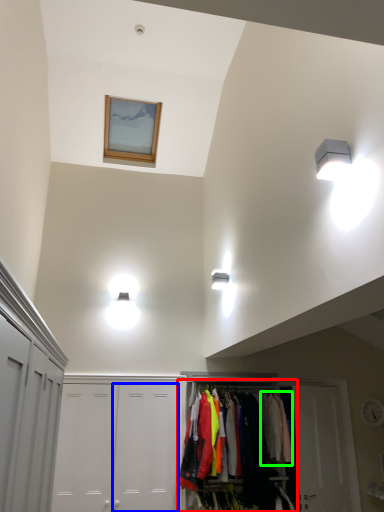
Question: Estimate the real-world distances between objects in this image. Which object is farther from dresser (highlighted by a red box), door (highlighted by a blue box) or clothing (highlighted by a green box)?

Choices:
 (A) door
 (B) clothing

Answer: (A)